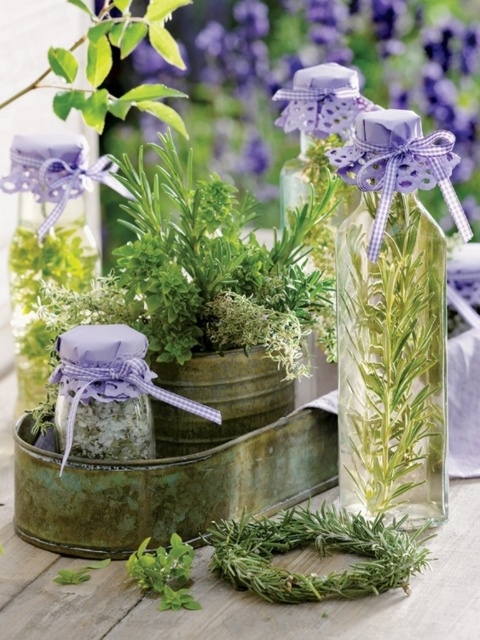
Question: Which point is farther to the camera?

Choices:
 (A) (195, 40)
 (B) (423, 433)

Answer: (A)

Question: Is matte purple glass bottle at upper center to the right of clear glass vase at center from the viewer's perspective?

Choices:
 (A) yes
 (B) no

Answer: (B)

Question: Is matte purple glass bottle at upper center closer to the viewer compared to clear glass vase at center?

Choices:
 (A) no
 (B) yes

Answer: (A)

Question: Is matte purple glass bottle at upper center positioned in front of clear glass vase at center?

Choices:
 (A) no
 (B) yes

Answer: (A)